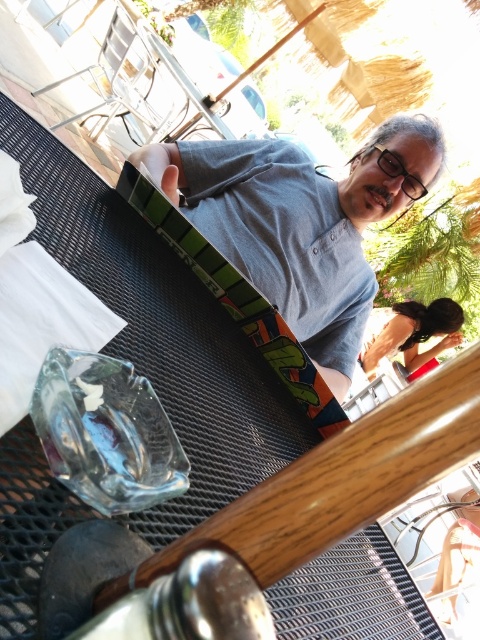
Question: Is gray matte t-shirt at center behind smooth skin woman at upper right?

Choices:
 (A) yes
 (B) no

Answer: (B)

Question: Which of the following is the closest to the observer?

Choices:
 (A) smooth skin woman at upper right
 (B) gray matte t-shirt at center

Answer: (B)

Question: Can you confirm if gray matte t-shirt at center is smaller than smooth skin woman at upper right?

Choices:
 (A) yes
 (B) no

Answer: (A)

Question: From the image, what is the correct spatial relationship of gray matte t-shirt at center in relation to smooth skin woman at upper right?

Choices:
 (A) below
 (B) above

Answer: (B)